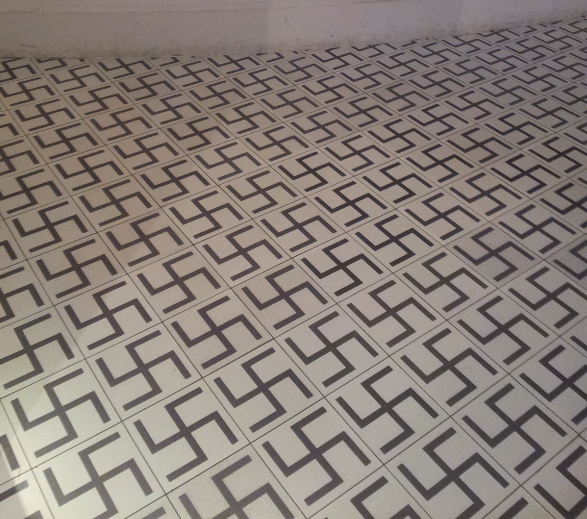
Identify the location of tile. The image size is (587, 519). pyautogui.click(x=484, y=380).